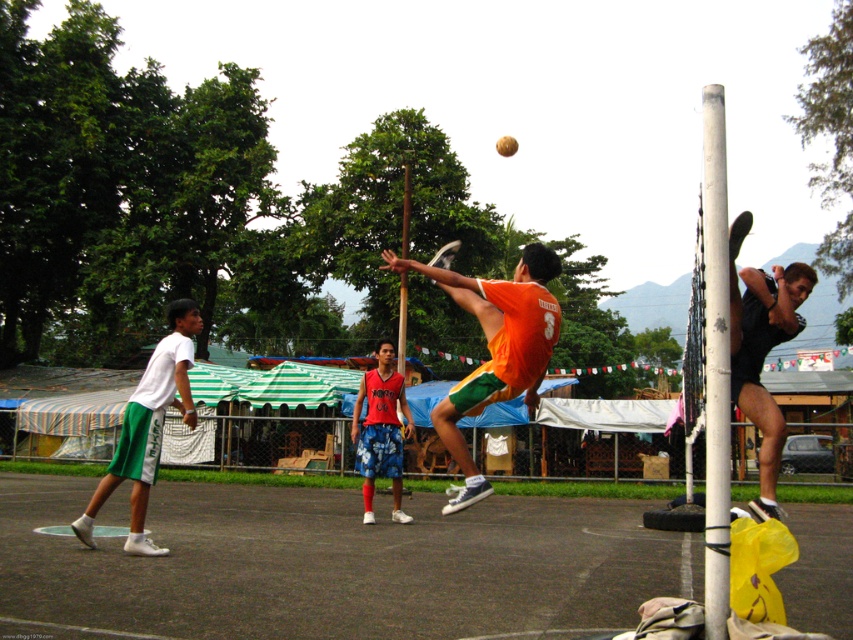
Between smooth asphalt court at center and orange jersey at center, which one is positioned lower?

Positioned lower is smooth asphalt court at center.

What do you see at coordinates (335, 564) in the screenshot? The image size is (853, 640). I see `smooth asphalt court at center` at bounding box center [335, 564].

Is point (660, 582) positioned before point (428, 266)?

No.

Locate an element on the screen. The width and height of the screenshot is (853, 640). smooth asphalt court at center is located at coordinates (335, 564).

Which of these two, smooth asphalt court at center or white plastic pole at upper center, stands shorter?

smooth asphalt court at center is shorter.

Who is positioned more to the left, smooth asphalt court at center or white plastic pole at upper center?

smooth asphalt court at center

Does point (622, 502) lie behind point (405, 301)?

No, it is not.

I want to click on smooth asphalt court at center, so click(335, 564).

Is point (538, 332) positioned after point (717, 289)?

Yes, it is.

Can you confirm if orange jersey at center is positioned above white painted wood pole at right?

No, orange jersey at center is not above white painted wood pole at right.

At what (x,y) coordinates should I click in order to perform the action: click on orange jersey at center. Please return your answer as a coordinate pair (x, y). The width and height of the screenshot is (853, 640). Looking at the image, I should click on (495, 348).